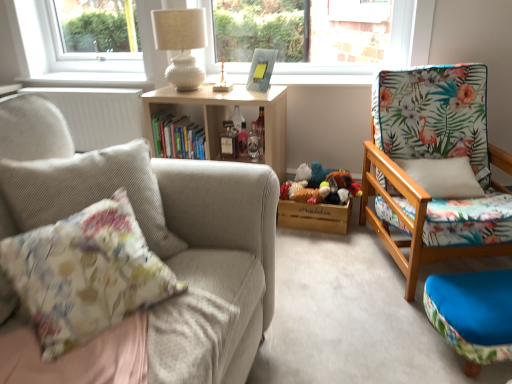
Identify the location of free space above wooden bookshelf at center (from a real-world perspective). (220, 90).